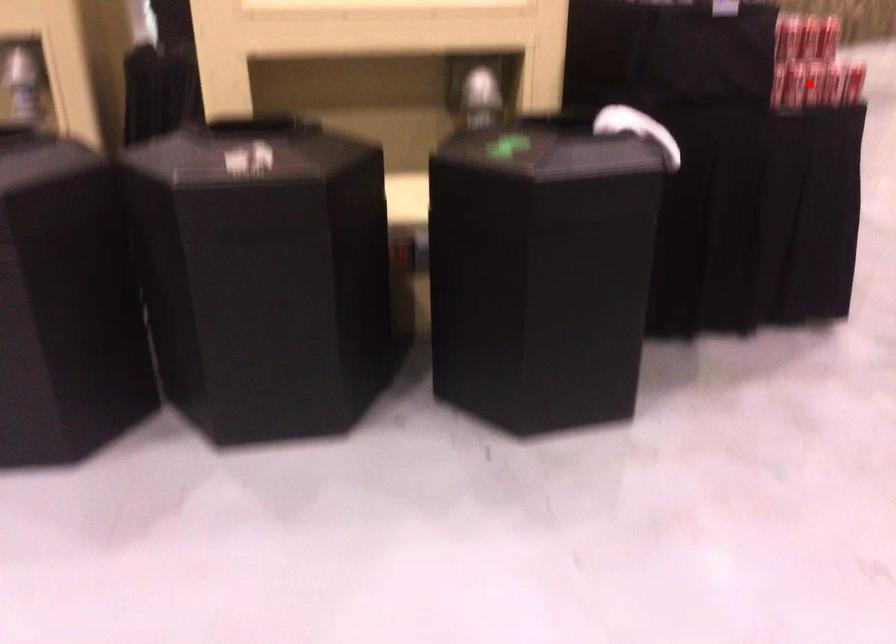
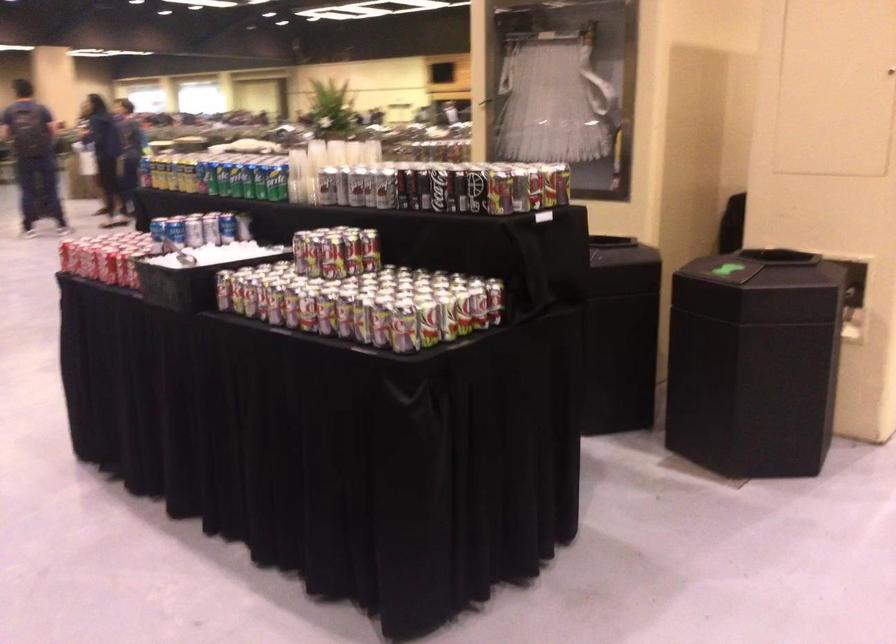
Question: I am providing you with two images of the same scene from different viewpoints. A red point is marked on the first image. Is the red point's position out of view in image 2?

Choices:
 (A) Yes
 (B) No

Answer: (A)